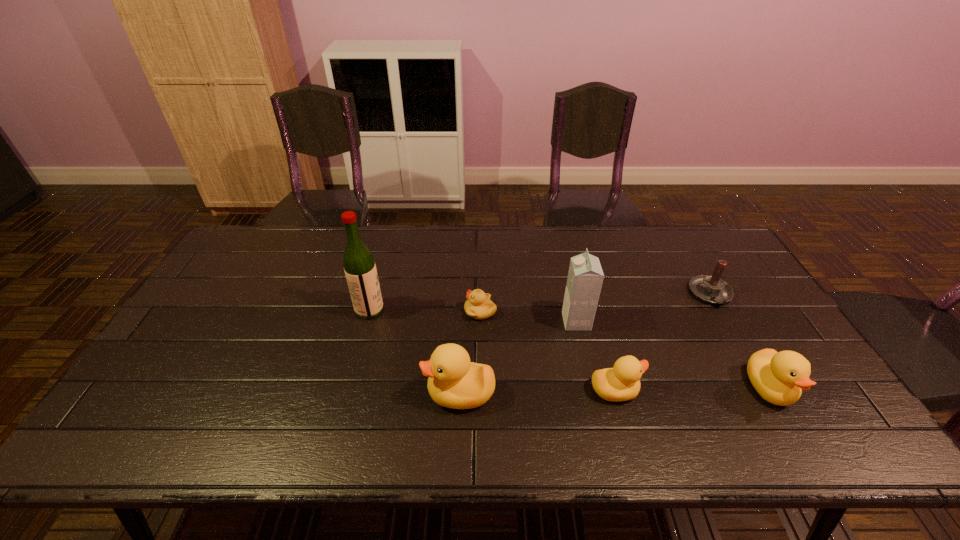
Point out which object is positioned as the sixth nearest to the third shortest duckling. Please provide its 2D coordinates. Your answer should be formatted as a tuple, i.e. [(x, y)], where the tuple contains the x and y coordinates of a point satisfying the conditions above.

[(360, 270)]

Identify which object is the third nearest to the second shortest duckling. Please provide its 2D coordinates. Your answer should be formatted as a tuple, i.e. [(x, y)], where the tuple contains the x and y coordinates of a point satisfying the conditions above.

[(779, 377)]

Identify which duckling is the third closest to the second shortest duckling. Please provide its 2D coordinates. Your answer should be formatted as a tuple, i.e. [(x, y)], where the tuple contains the x and y coordinates of a point satisfying the conditions above.

[(478, 306)]

Identify which duckling is the third nearest to the third shortest duckling. Please provide its 2D coordinates. Your answer should be formatted as a tuple, i.e. [(x, y)], where the tuple contains the x and y coordinates of a point satisfying the conditions above.

[(478, 306)]

The width and height of the screenshot is (960, 540). In order to click on free space that satisfies the following two spatial constraints: 1. on the side of the candle with the handle loop; 2. on the front label of the second tallest object in this screenshot , I will do `click(726, 321)`.